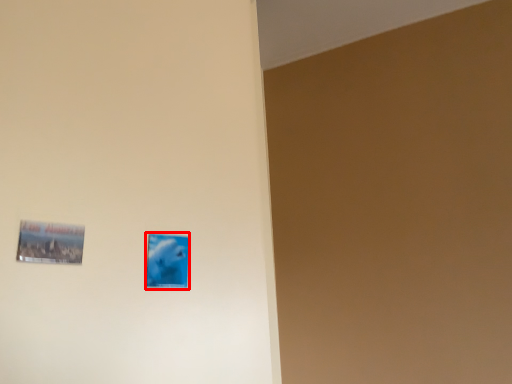
Question: From the image's perspective, considering the relative positions of picture frame (annotated by the red box) and picture frame in the image provided, where is picture frame (annotated by the red box) located with respect to the staircase?

Choices:
 (A) below
 (B) above

Answer: (A)